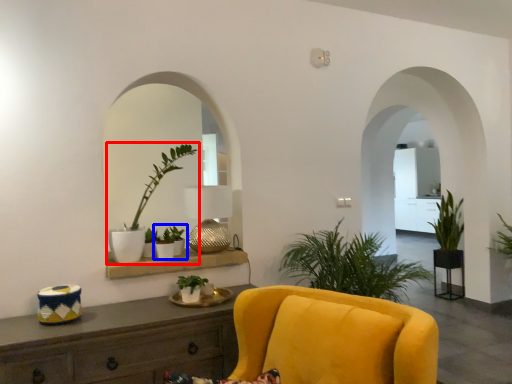
Question: Which object appears farthest to the camera in this image, houseplant (highlighted by a red box) or houseplant (highlighted by a blue box)?

Choices:
 (A) houseplant
 (B) houseplant

Answer: (B)